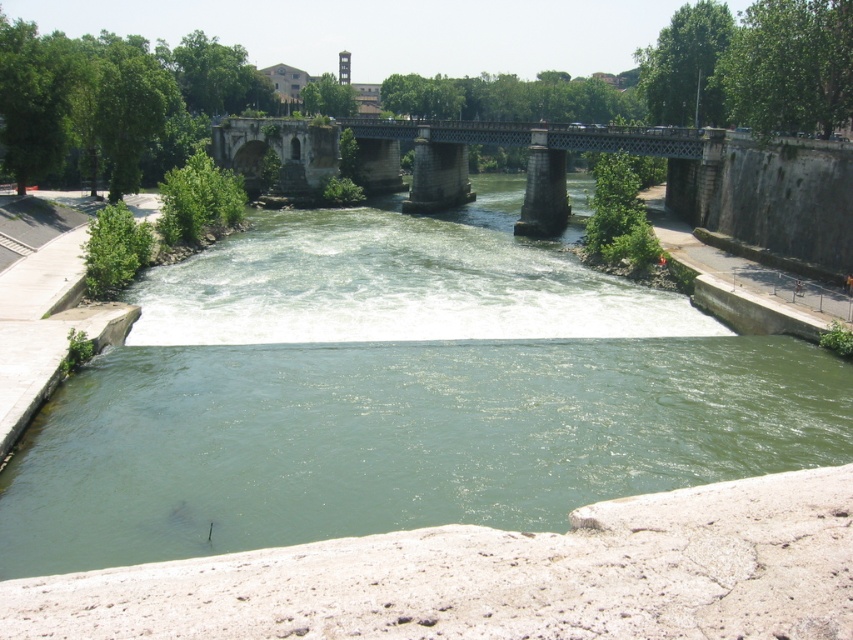
You are a pedestrian standing on the stone bridge at center. You want to walk to the green concrete river at center. Which direction should you move?

The green concrete river at center is to the left of the stone bridge at center, so you should move to the left to reach it.

You are standing on the bridge and want to reach the point marked at coordinates point (469, 486). The bridge is 30 meters long. Can you walk the entire length of the bridge to reach that point?

The distance between you and the point marked at coordinates point (469, 486) is 27.40 meters. Since the bridge is 30 meters long, you can walk the entire length of the bridge to reach that point as the distance is within the bridge length.

You are a pedestrian standing on the stone bridge at center. You want to cross the river and reach the other side. Which direction should you walk to avoid the green concrete river at center?

The green concrete river at center is below the stone bridge at center. To avoid it, walk towards the end of the stone bridge at center where it connects to the riverbank.